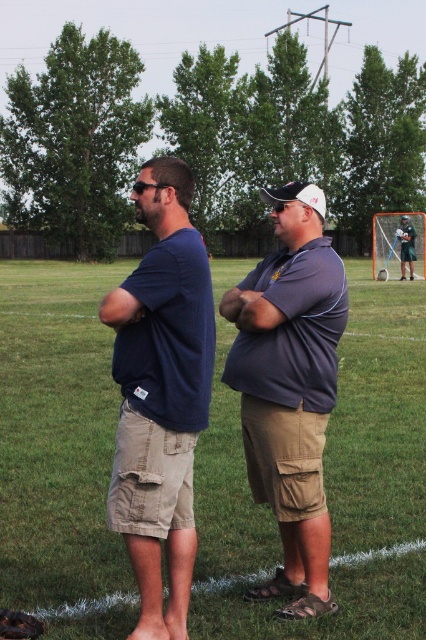
In the scene shown: Is dark blue shirt at center thinner than white matte baseball cap at center?

Indeed, dark blue shirt at center has a lesser width compared to white matte baseball cap at center.

Between dark blue shirt at center and white matte baseball cap at center, which one appears on the right side from the viewer's perspective?

Positioned to the right is white matte baseball cap at center.

Is point (175, 310) more distant than point (298, 182)?

No, it is not.

Locate an element on the screen. dark blue shirt at center is located at coordinates point(290,396).

Does dark blue shirt at center come in front of dark blue t-shirt at center?

Yes, dark blue shirt at center is in front of dark blue t-shirt at center.

Which is more to the left, dark blue shirt at center or dark blue t-shirt at center?

dark blue t-shirt at center is more to the left.

Image resolution: width=426 pixels, height=640 pixels. What do you see at coordinates (290, 396) in the screenshot? I see `dark blue shirt at center` at bounding box center [290, 396].

The image size is (426, 640). In order to click on dark blue shirt at center in this screenshot , I will do `click(290, 396)`.

Does dark blue t-shirt at center appear on the right side of matte gray shirt at center?

Incorrect, dark blue t-shirt at center is not on the right side of matte gray shirt at center.

Is dark blue t-shirt at center taller than matte gray shirt at center?

Correct, dark blue t-shirt at center is much taller as matte gray shirt at center.

Who is more distant from viewer, (x=192, y=548) or (x=330, y=410)?

Point (x=330, y=410)

Where is `dark blue t-shirt at center`? dark blue t-shirt at center is located at coordinates (161, 394).